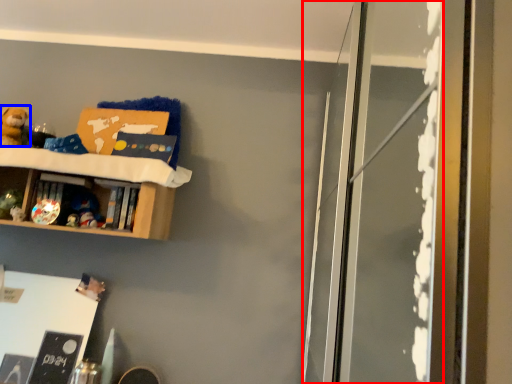
Question: Which of the following is the closest to the observer, screen door (highlighted by a red box) or toy (highlighted by a blue box)?

Choices:
 (A) screen door
 (B) toy

Answer: (A)